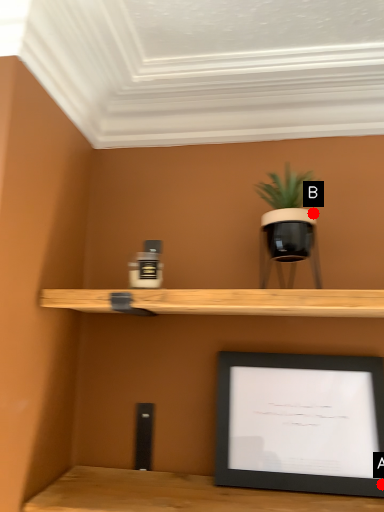
Question: Two points are circled on the image, labeled by A and B beside each circle. Which of the following is the farthest from the observer?

Choices:
 (A) A is further
 (B) B is further

Answer: (B)